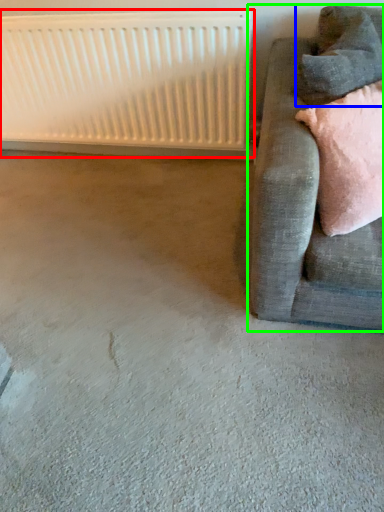
Question: Considering the real-world distances, which object is farthest from radiator (highlighted by a red box)? pillow (highlighted by a blue box) or studio couch (highlighted by a green box)?

Choices:
 (A) pillow
 (B) studio couch

Answer: (A)